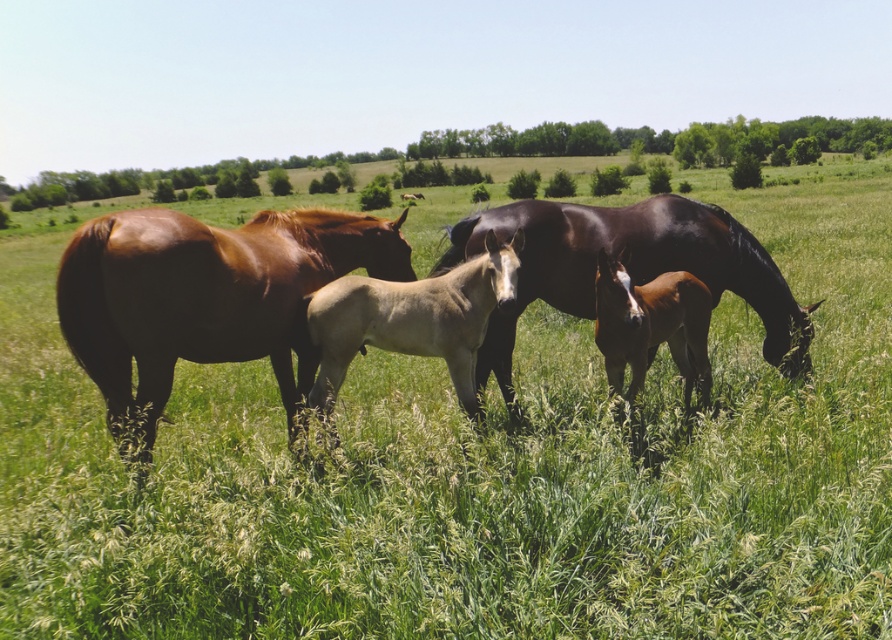
You are a farmer standing at the edge of the field. You want to locate the glossy dark brown horse at center. Where should you look relative to the point marked at coordinates [626,268]?

The glossy dark brown horse at center is located exactly at the point marked at coordinates [626,268].

You are a farmer checking on your animals. You see the shiny brown horse at center and the light tan smooth foal at center. Which horse is positioned to the right?

The light tan smooth foal at center is positioned to the right of the shiny brown horse at center.